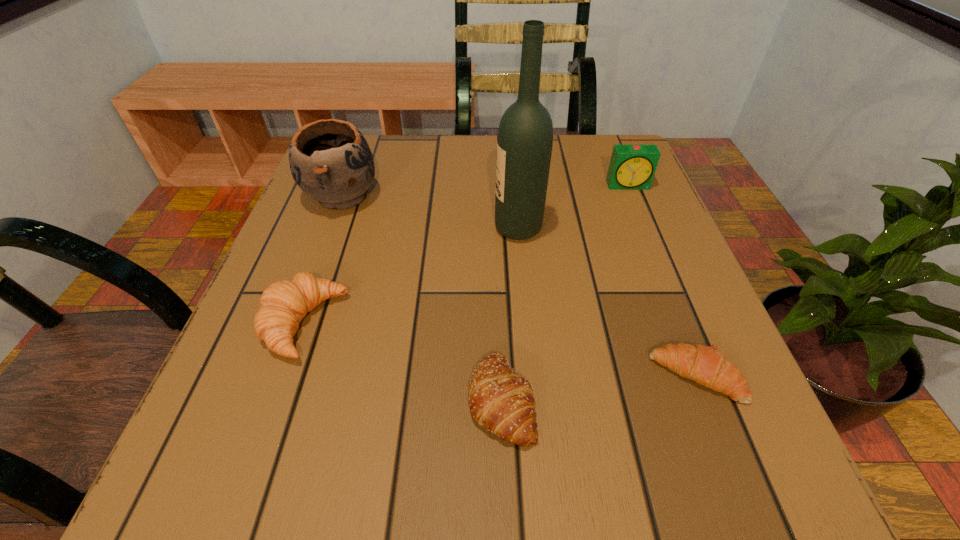
Locate an element on the screen. The image size is (960, 540). alarm clock that is at the right edge is located at coordinates (632, 167).

What are the coordinates of `crescent roll that is at the right edge` in the screenshot? It's located at (705, 365).

The width and height of the screenshot is (960, 540). Identify the location of object located at the far left corner. (330, 160).

Image resolution: width=960 pixels, height=540 pixels. Find the location of `object that is at the far right corner`. object that is at the far right corner is located at coordinates coord(632,167).

Find the location of `free space at the far edge`. free space at the far edge is located at coordinates (456, 135).

In the image, there is a desktop. Identify the location of vacant space at the near edge. This screenshot has height=540, width=960. (358, 460).

The height and width of the screenshot is (540, 960). What are the coordinates of `vacant space at the right edge of the desktop` in the screenshot? It's located at (655, 272).

This screenshot has width=960, height=540. In order to click on free location at the near left corner of the desktop in this screenshot , I will do click(271, 482).

At what (x,y) coordinates should I click in order to perform the action: click on vacant space at the far right corner of the desktop. Please return your answer as a coordinate pair (x, y). This screenshot has height=540, width=960. Looking at the image, I should click on (596, 179).

Identify the location of vacant region at the near right corner of the desktop. The image size is (960, 540). (747, 450).